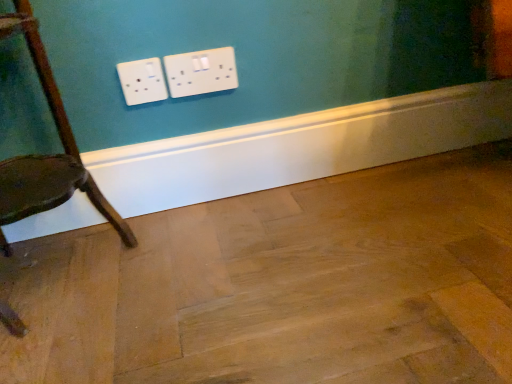
Question: Considering the relative positions of wooden chair at left and natural wood floor at center in the image provided, is wooden chair at left behind natural wood floor at center?

Choices:
 (A) no
 (B) yes

Answer: (B)

Question: Considering the relative sizes of wooden chair at left and natural wood floor at center in the image provided, is wooden chair at left bigger than natural wood floor at center?

Choices:
 (A) yes
 (B) no

Answer: (A)

Question: Does wooden chair at left lie in front of natural wood floor at center?

Choices:
 (A) no
 (B) yes

Answer: (A)

Question: Is wooden chair at left beside natural wood floor at center?

Choices:
 (A) no
 (B) yes

Answer: (A)

Question: From a real-world perspective, is wooden chair at left positioned under natural wood floor at center based on gravity?

Choices:
 (A) yes
 (B) no

Answer: (B)

Question: Would you say natural wood floor at center is part of wooden chair at left's contents?

Choices:
 (A) yes
 (B) no

Answer: (B)

Question: Could you tell me if natural wood floor at center is facing wooden chair at left?

Choices:
 (A) yes
 (B) no

Answer: (B)

Question: From a real-world perspective, is natural wood floor at center positioned under wooden chair at left based on gravity?

Choices:
 (A) no
 (B) yes

Answer: (B)

Question: From a real-world perspective, is natural wood floor at center on wooden chair at left?

Choices:
 (A) no
 (B) yes

Answer: (A)

Question: Does natural wood floor at center have a lesser height compared to wooden chair at left?

Choices:
 (A) no
 (B) yes

Answer: (B)

Question: Considering the relative sizes of natural wood floor at center and wooden chair at left in the image provided, is natural wood floor at center wider than wooden chair at left?

Choices:
 (A) no
 (B) yes

Answer: (B)

Question: Is natural wood floor at center outside of wooden chair at left?

Choices:
 (A) yes
 (B) no

Answer: (A)

Question: Would you say wooden chair at left is inside or outside natural wood floor at center?

Choices:
 (A) outside
 (B) inside

Answer: (A)